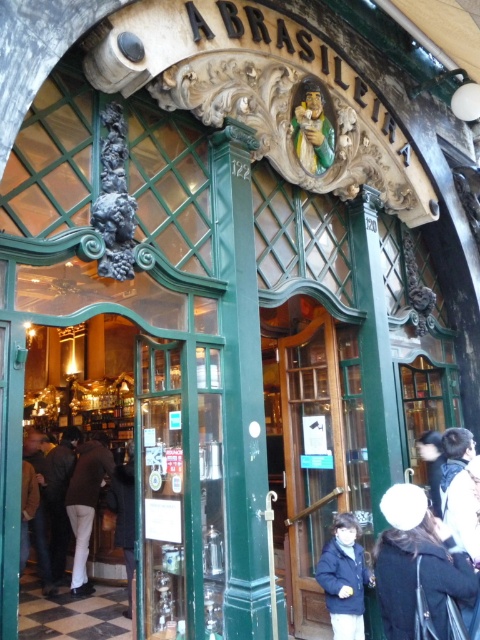
From the picture: Who is positioned more to the left, green polished wood pillar at center or dark blue jacket at lower center?

green polished wood pillar at center

Can you confirm if green polished wood pillar at center is wider than dark blue jacket at lower center?

Indeed, green polished wood pillar at center has a greater width compared to dark blue jacket at lower center.

Who is more distant from viewer, (245,484) or (336,541)?

The point (336,541) is more distant.

The height and width of the screenshot is (640, 480). What are the coordinates of `green polished wood pillar at center` in the screenshot? It's located at (240, 388).

Does white fur coat at lower right appear over dark brown leather jacket at lower left?

Yes, white fur coat at lower right is above dark brown leather jacket at lower left.

Can you confirm if white fur coat at lower right is positioned below dark brown leather jacket at lower left?

Actually, white fur coat at lower right is above dark brown leather jacket at lower left.

This screenshot has height=640, width=480. Identify the location of white fur coat at lower right. (420, 570).

The height and width of the screenshot is (640, 480). Find the location of `white fur coat at lower right`. white fur coat at lower right is located at coordinates [420, 570].

Is green polished wood pillar at center positioned behind white matte pants at lower left?

No, green polished wood pillar at center is closer to the viewer.

Measure the distance between point (226, 582) and camera.

14.90 feet

At what (x,y) coordinates should I click in order to perform the action: click on green polished wood pillar at center. Please return your answer as a coordinate pair (x, y). The height and width of the screenshot is (640, 480). Looking at the image, I should click on (240, 388).